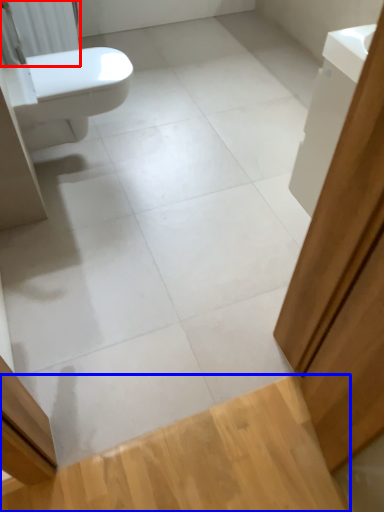
Question: Among these objects, which one is farthest to the camera, radiator (highlighted by a red box) or plank (highlighted by a blue box)?

Choices:
 (A) radiator
 (B) plank

Answer: (A)